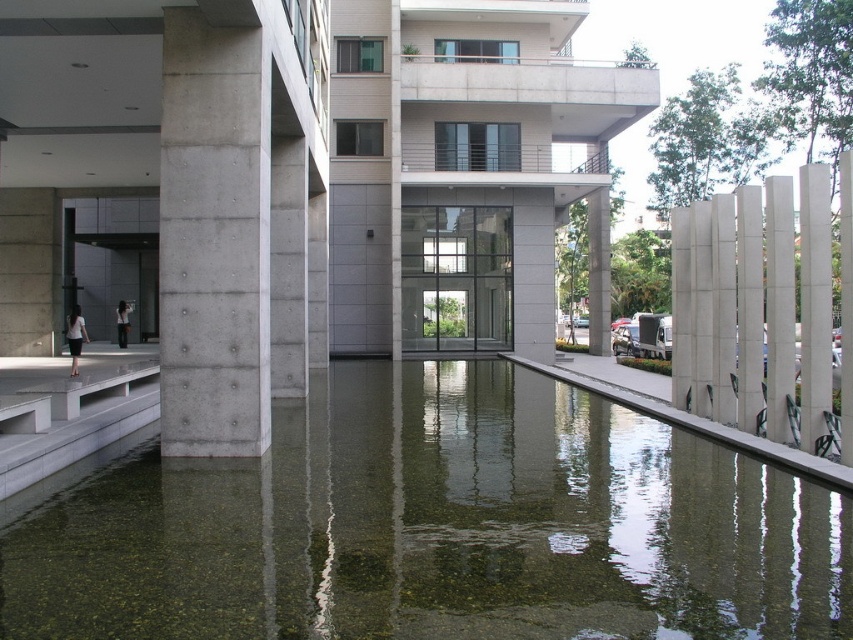
Is point (309, 397) closer to camera compared to point (199, 376)?

No.

In the scene shown: Does clear concrete pool at center have a lesser width compared to gray concrete pillar at center?

Incorrect, clear concrete pool at center's width is not less than gray concrete pillar at center's.

Which is behind, point (595, 602) or point (231, 328)?

The point (231, 328) is behind.

Where is `clear concrete pool at center`? Image resolution: width=853 pixels, height=640 pixels. clear concrete pool at center is located at coordinates (439, 525).